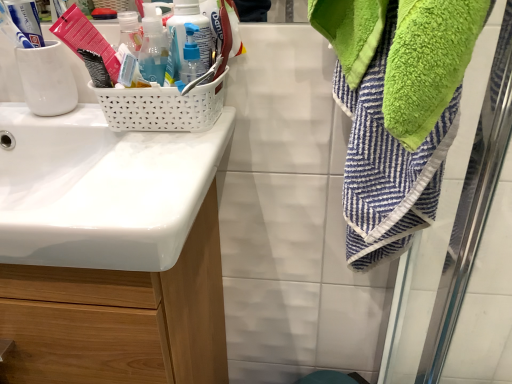
Question: From a real-world perspective, is translucent plastic pump bottle at center, arranged as the 1th bottle when viewed from the right, physically below white glossy sink at left?

Choices:
 (A) no
 (B) yes

Answer: (A)

Question: Could you tell me if translucent plastic pump bottle at center, arranged as the 1th bottle when viewed from the right, is turned towards white glossy sink at left?

Choices:
 (A) no
 (B) yes

Answer: (A)

Question: Does translucent plastic pump bottle at center, placed as the 3th bottle when sorted from left to right, lie behind white glossy sink at left?

Choices:
 (A) yes
 (B) no

Answer: (A)

Question: Is translucent plastic pump bottle at center, arranged as the 1th bottle when viewed from the right, next to white glossy sink at left?

Choices:
 (A) yes
 (B) no

Answer: (B)

Question: Does translucent plastic pump bottle at center, arranged as the 1th bottle when viewed from the right, have a greater height compared to white glossy sink at left?

Choices:
 (A) no
 (B) yes

Answer: (A)

Question: Relative to white glossy sink at left, is translucent plastic soap dispenser at upper left, which ranks as the 3th bottle in right-to-left order, in front or behind?

Choices:
 (A) front
 (B) behind

Answer: (B)

Question: From their relative heights in the image, would you say translucent plastic soap dispenser at upper left, which is counted as the 1th bottle, starting from the left, is taller or shorter than white glossy sink at left?

Choices:
 (A) tall
 (B) short

Answer: (A)

Question: In terms of width, does translucent plastic soap dispenser at upper left, which ranks as the 3th bottle in right-to-left order, look wider or thinner when compared to white glossy sink at left?

Choices:
 (A) wide
 (B) thin

Answer: (B)

Question: Considering the positions of translucent plastic soap dispenser at upper left, which ranks as the 3th bottle in right-to-left order, and white glossy sink at left in the image, is translucent plastic soap dispenser at upper left, which ranks as the 3th bottle in right-to-left order, bigger or smaller than white glossy sink at left?

Choices:
 (A) big
 (B) small

Answer: (B)

Question: Is translucent plastic soap dispenser at upper left, which is counted as the 1th bottle, starting from the left, spatially inside translucent plastic pump bottle at upper center, acting as the second bottle starting from the left, or outside of it?

Choices:
 (A) outside
 (B) inside

Answer: (A)

Question: Considering their positions, is translucent plastic soap dispenser at upper left, which ranks as the 3th bottle in right-to-left order, located in front of or behind translucent plastic pump bottle at upper center, acting as the second bottle starting from the left?

Choices:
 (A) behind
 (B) front

Answer: (B)

Question: Considering the positions of point (148, 13) and point (175, 1), is point (148, 13) closer or farther from the camera than point (175, 1)?

Choices:
 (A) farther
 (B) closer

Answer: (B)

Question: Is translucent plastic soap dispenser at upper left, which ranks as the 3th bottle in right-to-left order, taller or shorter than translucent plastic pump bottle at upper center, positioned as the 2th bottle in right-to-left order?

Choices:
 (A) short
 (B) tall

Answer: (A)

Question: Visually, is translucent plastic pump bottle at upper center, acting as the second bottle starting from the left, positioned to the left or to the right of white glossy sink at left?

Choices:
 (A) right
 (B) left

Answer: (A)

Question: Does point (181, 4) appear closer or farther from the camera than point (42, 196)?

Choices:
 (A) farther
 (B) closer

Answer: (B)